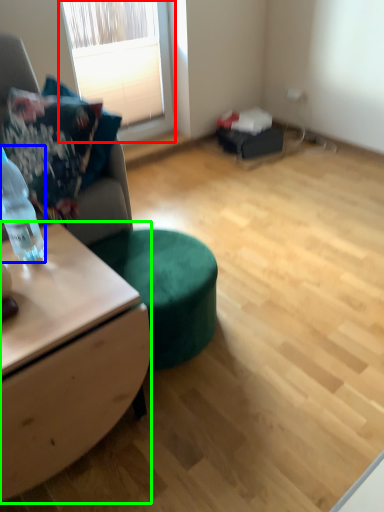
Question: Considering the real-world distances, which object is farthest from window (highlighted by a red box)? bottle (highlighted by a blue box) or desk (highlighted by a green box)?

Choices:
 (A) bottle
 (B) desk

Answer: (B)